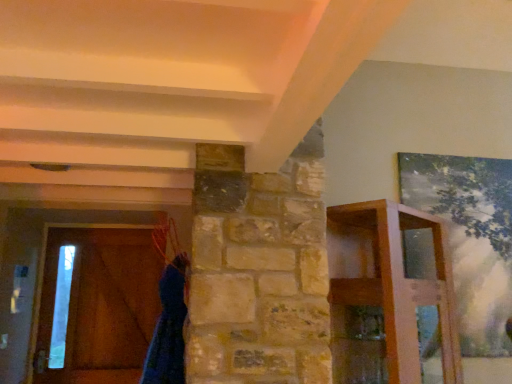
Where is `brown wooden barn door at left`? This screenshot has height=384, width=512. brown wooden barn door at left is located at coordinates (100, 305).

The image size is (512, 384). What do you see at coordinates (168, 329) in the screenshot?
I see `blue fuzzy robe at lower left` at bounding box center [168, 329].

The height and width of the screenshot is (384, 512). What do you see at coordinates (401, 286) in the screenshot?
I see `wooden shelf at right` at bounding box center [401, 286].

Where is `brown wooden barn door at left`? The width and height of the screenshot is (512, 384). brown wooden barn door at left is located at coordinates pos(100,305).

Consider the image. From their relative heights in the image, would you say blue fuzzy robe at lower left is taller or shorter than wooden shelf at right?

Clearly, blue fuzzy robe at lower left is shorter compared to wooden shelf at right.

Could wooden shelf at right be considered to be inside blue fuzzy robe at lower left?

No, wooden shelf at right is not a part of blue fuzzy robe at lower left.

Looking at this image, is blue fuzzy robe at lower left oriented towards wooden shelf at right?

No, blue fuzzy robe at lower left is not oriented towards wooden shelf at right.

Which of these two, blue fuzzy robe at lower left or wooden shelf at right, is smaller?

blue fuzzy robe at lower left.

Is brown wooden barn door at left at the back of blue fuzzy robe at lower left?

No, blue fuzzy robe at lower left is not facing away from brown wooden barn door at left.

Is blue fuzzy robe at lower left wider or thinner than brown wooden barn door at left?

Considering their sizes, blue fuzzy robe at lower left looks broader than brown wooden barn door at left.

Who is bigger, blue fuzzy robe at lower left or brown wooden barn door at left?

Bigger between the two is blue fuzzy robe at lower left.

The image size is (512, 384). In order to click on robe above the brown wooden barn door at left (from the image's perspective) in this screenshot , I will do `click(168, 329)`.

At what (x,y) coordinates should I click in order to perform the action: click on robe on the left of the wooden shelf at right. Please return your answer as a coordinate pair (x, y). Looking at the image, I should click on (168, 329).

Considering the relative positions of wooden shelf at right and blue fuzzy robe at lower left in the image provided, is wooden shelf at right to the left of blue fuzzy robe at lower left from the viewer's perspective?

No, wooden shelf at right is not to the left of blue fuzzy robe at lower left.

From a real-world perspective, is wooden shelf at right physically located above or below blue fuzzy robe at lower left?

wooden shelf at right is situated higher than blue fuzzy robe at lower left in the real world.

Can you tell me how much wooden shelf at right and blue fuzzy robe at lower left differ in facing direction?

127 degrees.

Is brown wooden barn door at left oriented towards wooden shelf at right?

No, brown wooden barn door at left does not turn towards wooden shelf at right.

Which of these two, brown wooden barn door at left or wooden shelf at right, stands taller?

With more height is brown wooden barn door at left.

Image resolution: width=512 pixels, height=384 pixels. Identify the location of barn door on the left side of wooden shelf at right. (100, 305).

Is there a large distance between brown wooden barn door at left and wooden shelf at right?

Yes, brown wooden barn door at left and wooden shelf at right are located far from each other.

Is brown wooden barn door at left not near blue fuzzy robe at lower left?

brown wooden barn door at left is far away from blue fuzzy robe at lower left.

Is brown wooden barn door at left wider than blue fuzzy robe at lower left?

No.

From a real-world perspective, who is located lower, brown wooden barn door at left or blue fuzzy robe at lower left?

blue fuzzy robe at lower left, from a real-world perspective.

Can you confirm if brown wooden barn door at left is taller than blue fuzzy robe at lower left?

Correct, brown wooden barn door at left is much taller as blue fuzzy robe at lower left.

Is point (386, 216) positioned in front of point (139, 300)?

Yes, point (386, 216) is in front of point (139, 300).

How distant is wooden shelf at right from brown wooden barn door at left?

wooden shelf at right and brown wooden barn door at left are 6.37 feet apart.

Is wooden shelf at right at the right side of brown wooden barn door at left?

Indeed, wooden shelf at right is positioned on the right side of brown wooden barn door at left.

Is there a large distance between wooden shelf at right and brown wooden barn door at left?

Yes, wooden shelf at right and brown wooden barn door at left are quite far apart.

Identify the location of furniture that is above the blue fuzzy robe at lower left (from the image's perspective). Image resolution: width=512 pixels, height=384 pixels. (401, 286).

Find the location of a particular element. The image size is (512, 384). barn door below the blue fuzzy robe at lower left (from the image's perspective) is located at coordinates (100, 305).

Considering their positions, is wooden shelf at right positioned further to brown wooden barn door at left than blue fuzzy robe at lower left?

wooden shelf at right.

From the image, which object appears to be farther from brown wooden barn door at left, blue fuzzy robe at lower left or wooden shelf at right?

The object further to brown wooden barn door at left is wooden shelf at right.

Considering their positions, is blue fuzzy robe at lower left positioned closer to wooden shelf at right than brown wooden barn door at left?

Based on the image, blue fuzzy robe at lower left appears to be nearer to wooden shelf at right.

Looking at this image, considering their positions, is brown wooden barn door at left positioned further to blue fuzzy robe at lower left than wooden shelf at right?

Among the two, brown wooden barn door at left is located further to blue fuzzy robe at lower left.

When comparing their distances from wooden shelf at right, does brown wooden barn door at left or blue fuzzy robe at lower left seem closer?

blue fuzzy robe at lower left is closer to wooden shelf at right.

From the image, which object appears to be farther from blue fuzzy robe at lower left, wooden shelf at right or brown wooden barn door at left?

Among the two, brown wooden barn door at left is located further to blue fuzzy robe at lower left.

This screenshot has height=384, width=512. Identify the location of robe between brown wooden barn door at left and wooden shelf at right from left to right. (168, 329).